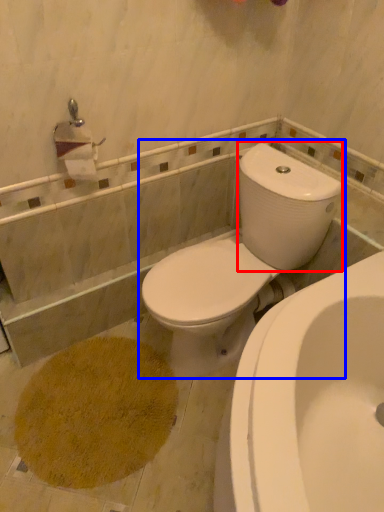
Question: Which point is closer to the camera, water tank (highlighted by a red box) or toilet (highlighted by a blue box)?

Choices:
 (A) water tank
 (B) toilet

Answer: (B)